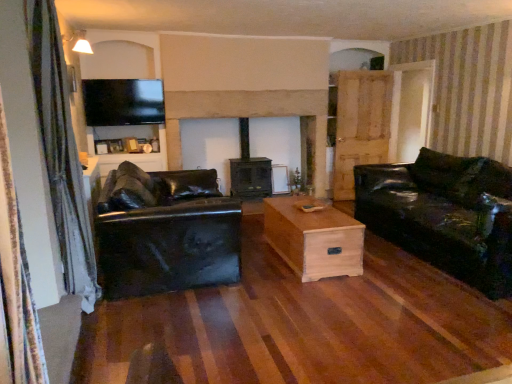
Question: From a real-world perspective, is silky blue curtain at left physically above transparent glass door at right?

Choices:
 (A) no
 (B) yes

Answer: (A)

Question: From a real-world perspective, is silky blue curtain at left under transparent glass door at right?

Choices:
 (A) yes
 (B) no

Answer: (A)

Question: From the image's perspective, is silky blue curtain at left below transparent glass door at right?

Choices:
 (A) no
 (B) yes

Answer: (B)

Question: Considering the relative sizes of silky blue curtain at left and transparent glass door at right in the image provided, is silky blue curtain at left thinner than transparent glass door at right?

Choices:
 (A) no
 (B) yes

Answer: (A)

Question: Is silky blue curtain at left far away from transparent glass door at right?

Choices:
 (A) no
 (B) yes

Answer: (B)

Question: Can you confirm if silky blue curtain at left is smaller than transparent glass door at right?

Choices:
 (A) yes
 (B) no

Answer: (A)

Question: Does glossy black leather couch at right, which is counted as the first studio couch, starting from the right, come in front of smooth stone fireplace at center?

Choices:
 (A) yes
 (B) no

Answer: (A)

Question: Are glossy black leather couch at right, which is counted as the first studio couch, starting from the right, and smooth stone fireplace at center beside each other?

Choices:
 (A) yes
 (B) no

Answer: (B)

Question: Is glossy black leather couch at right, the 2th studio couch positioned from the left, aimed at smooth stone fireplace at center?

Choices:
 (A) no
 (B) yes

Answer: (A)

Question: Is glossy black leather couch at right, which is counted as the first studio couch, starting from the right, positioned with its back to smooth stone fireplace at center?

Choices:
 (A) yes
 (B) no

Answer: (B)

Question: Is glossy black leather couch at right, the 2th studio couch positioned from the left, far from smooth stone fireplace at center?

Choices:
 (A) no
 (B) yes

Answer: (B)

Question: From the image's perspective, is glossy black leather couch at right, the 2th studio couch positioned from the left, below smooth stone fireplace at center?

Choices:
 (A) yes
 (B) no

Answer: (A)

Question: Is black leather couch at left, marked as the 2th studio couch in a right-to-left arrangement, smaller than light wood/texture coffee table at center?

Choices:
 (A) yes
 (B) no

Answer: (B)